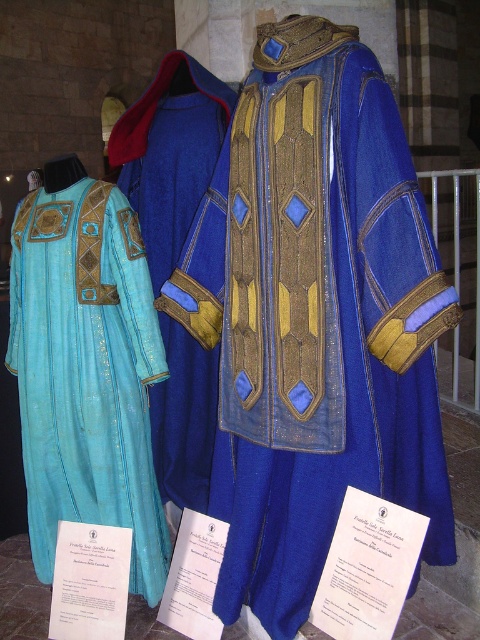
You are a museum curator arranging an exhibit. You need to ensure that the blue velvet jacket at center and the velvet blue robe at center are displayed in a way that allows visitors to see both items clearly. Based on their current positions, which garment is placed lower and might require adjustment to ensure visibility?

The blue velvet jacket at center is positioned under the velvet blue robe at center, so it is placed lower and might require adjustment to ensure visibility.

You are a museum curator preparing to display the blue velvet jacket at center and the matte blue fabric robe at left. Which garment should you allocate more space to in the exhibit to accommodate its size?

The blue velvet jacket at center has a larger size compared to the matte blue fabric robe at left, so you should allocate more space to the blue velvet jacket at center.